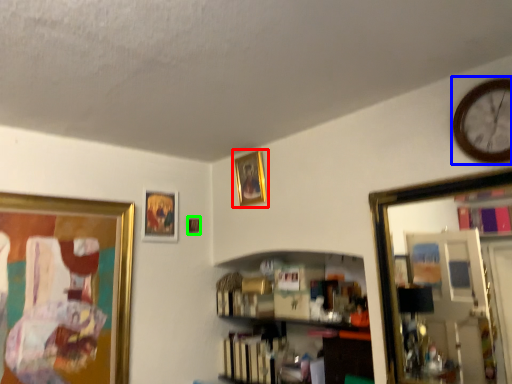
Question: Which is farther away from picture frame (highlighted by a red box)? clock (highlighted by a blue box) or picture frame (highlighted by a green box)?

Choices:
 (A) clock
 (B) picture frame

Answer: (A)